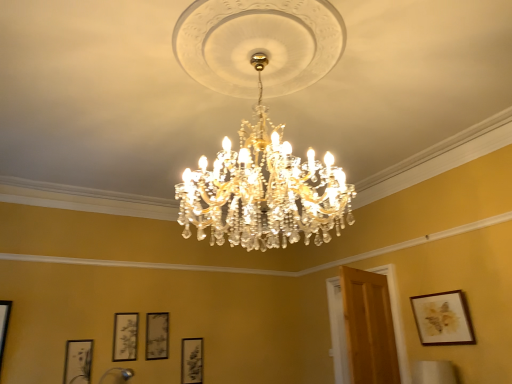
Question: Does wooden framed artwork at upper right, which ranks as the 5th picture frame in back-to-front order, have a lesser width compared to matte black picture frame at lower left, marked as the fourth picture frame in a back-to-front arrangement?

Choices:
 (A) yes
 (B) no

Answer: (B)

Question: From a real-world perspective, is wooden framed artwork at upper right, which is counted as the fifth picture frame, starting from the left, over matte black picture frame at lower left, which is the 2th picture frame from front to back?

Choices:
 (A) yes
 (B) no

Answer: (A)

Question: Would you say wooden framed artwork at upper right, which ranks as the 5th picture frame in back-to-front order, is outside matte black picture frame at lower left, acting as the first picture frame starting from the left?

Choices:
 (A) yes
 (B) no

Answer: (A)

Question: Can you confirm if wooden framed artwork at upper right, the first picture frame positioned from the front, is positioned to the left of matte black picture frame at lower left, which is the 2th picture frame from front to back?

Choices:
 (A) yes
 (B) no

Answer: (B)

Question: Is wooden framed artwork at upper right, which is counted as the fifth picture frame, starting from the left, at the right side of matte black picture frame at lower left, acting as the first picture frame starting from the left?

Choices:
 (A) no
 (B) yes

Answer: (B)

Question: Looking at the image, does matte black picture frame at lower center, which is the 4th picture frame from left to right, seem bigger or smaller compared to wooden framed artwork at upper right, which ranks as the 5th picture frame in back-to-front order?

Choices:
 (A) small
 (B) big

Answer: (A)

Question: Which is correct: matte black picture frame at lower center, which is the 4th picture frame from left to right, is inside wooden framed artwork at upper right, which is counted as the fifth picture frame, starting from the left, or outside of it?

Choices:
 (A) inside
 (B) outside

Answer: (B)

Question: In the image, is matte black picture frame at lower center, positioned as the first picture frame in back-to-front order, positioned in front of or behind wooden framed artwork at upper right, which is counted as the fifth picture frame, starting from the left?

Choices:
 (A) behind
 (B) front

Answer: (A)

Question: Considering the positions of matte black picture frame at lower center, arranged as the second picture frame when viewed from the right, and wooden framed artwork at upper right, marked as the 1th picture frame in a right-to-left arrangement, in the image, is matte black picture frame at lower center, arranged as the second picture frame when viewed from the right, taller or shorter than wooden framed artwork at upper right, marked as the 1th picture frame in a right-to-left arrangement,?

Choices:
 (A) short
 (B) tall

Answer: (B)

Question: In terms of height, does wooden framed artwork at upper right, which ranks as the 5th picture frame in back-to-front order, look taller or shorter compared to matte black picture frame at lower center, positioned as the third picture frame in right-to-left order?

Choices:
 (A) tall
 (B) short

Answer: (B)

Question: From a real-world perspective, is wooden framed artwork at upper right, which is counted as the fifth picture frame, starting from the left, physically located above or below matte black picture frame at lower center, positioned as the third picture frame in right-to-left order?

Choices:
 (A) below
 (B) above

Answer: (B)

Question: Considering their positions, is wooden framed artwork at upper right, which ranks as the 5th picture frame in back-to-front order, located in front of or behind matte black picture frame at lower center, positioned as the third picture frame in right-to-left order?

Choices:
 (A) behind
 (B) front

Answer: (B)

Question: In the image, is wooden framed artwork at upper right, marked as the 1th picture frame in a right-to-left arrangement, on the left side or the right side of matte black picture frame at lower center, the 2th picture frame viewed from the back?

Choices:
 (A) right
 (B) left

Answer: (A)

Question: Would you say wooden framed artwork at upper right, marked as the 1th picture frame in a right-to-left arrangement, is to the left or to the right of matte black picture frame at lower left, marked as the fourth picture frame in a back-to-front arrangement, in the picture?

Choices:
 (A) right
 (B) left

Answer: (A)

Question: Is wooden framed artwork at upper right, which is counted as the fifth picture frame, starting from the left, bigger or smaller than matte black picture frame at lower left, placed as the fifth picture frame when sorted from right to left?

Choices:
 (A) big
 (B) small

Answer: (A)